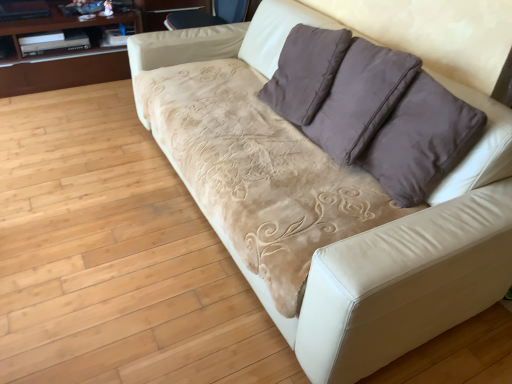
Describe the element at coordinates (421, 141) in the screenshot. The height and width of the screenshot is (384, 512). I see `brown suede pillow at upper right` at that location.

This screenshot has width=512, height=384. What are the coordinates of `velvet beige armchair at upper center` in the screenshot? It's located at (209, 15).

Is brown suede pillow at upper right inside the boundaries of wooden glossy dresser at upper left, or outside?

brown suede pillow at upper right is spatially situated outside wooden glossy dresser at upper left.

Is brown suede pillow at upper right taller or shorter than wooden glossy dresser at upper left?

Considering their sizes, brown suede pillow at upper right has more height than wooden glossy dresser at upper left.

From the image's perspective, which object appears higher, brown suede pillow at upper right or wooden glossy dresser at upper left?

From the image's view, wooden glossy dresser at upper left is above.

Between point (429, 91) and point (69, 54), which one is positioned in front?

Positioned in front is point (429, 91).

This screenshot has height=384, width=512. I want to click on dresser lying behind the brown suede pillow at upper right, so point(62,70).

From the image's perspective, is wooden glossy dresser at upper left under brown suede pillow at upper right?

No, from the image's perspective, wooden glossy dresser at upper left is not beneath brown suede pillow at upper right.

Can you see wooden glossy dresser at upper left touching brown suede pillow at upper right?

No, wooden glossy dresser at upper left is not next to brown suede pillow at upper right.

Looking at this image, between wooden glossy dresser at upper left and brown suede pillow at upper right, which one has smaller size?

Smaller between the two is brown suede pillow at upper right.

Based on the photo, which object is closer to the camera taking this photo, velvet beige armchair at upper center or wooden glossy dresser at upper left?

velvet beige armchair at upper center is more forward.

Is point (214, 15) closer to camera compared to point (30, 24)?

Yes, point (214, 15) is closer to viewer.

Identify the location of dresser below the velvet beige armchair at upper center (from a real-world perspective). This screenshot has width=512, height=384. (62, 70).

Is velvet beige armchair at upper center far from wooden glossy dresser at upper left?

No, there isn't a large distance between velvet beige armchair at upper center and wooden glossy dresser at upper left.

Considering the relative sizes of wooden glossy dresser at upper left and velvet beige armchair at upper center in the image provided, is wooden glossy dresser at upper left smaller than velvet beige armchair at upper center?

Incorrect, wooden glossy dresser at upper left is not smaller in size than velvet beige armchair at upper center.

Identify the location of armchair in front of the wooden glossy dresser at upper left. (209, 15).

Which is correct: wooden glossy dresser at upper left is inside velvet beige armchair at upper center, or outside of it?

wooden glossy dresser at upper left is not inside velvet beige armchair at upper center, it's outside.

Between wooden glossy dresser at upper left and velvet beige armchair at upper center, which one is positioned behind?

wooden glossy dresser at upper left is behind.

Is brown suede pillow at upper right looking in the opposite direction of velvet beige armchair at upper center?

→ That's not correct — brown suede pillow at upper right is not looking away from velvet beige armchair at upper center.

Would you say brown suede pillow at upper right is inside or outside velvet beige armchair at upper center?

brown suede pillow at upper right lies outside velvet beige armchair at upper center.

In the scene shown: Considering the sizes of objects brown suede pillow at upper right and velvet beige armchair at upper center in the image provided, who is taller, brown suede pillow at upper right or velvet beige armchair at upper center?

brown suede pillow at upper right is taller.

From the image's perspective, is velvet beige armchair at upper center below brown suede pillow at upper right?

No, from the image's perspective, velvet beige armchair at upper center is not below brown suede pillow at upper right.

Based on their sizes in the image, would you say velvet beige armchair at upper center is bigger or smaller than brown suede pillow at upper right?

Considering their sizes, velvet beige armchair at upper center takes up less space than brown suede pillow at upper right.

From a real-world perspective, which is physically below, velvet beige armchair at upper center or brown suede pillow at upper right?

velvet beige armchair at upper center, from a real-world perspective.

Considering the relative positions of velvet beige armchair at upper center and brown suede pillow at upper right in the image provided, is velvet beige armchair at upper center to the left of brown suede pillow at upper right from the viewer's perspective?

Yes, velvet beige armchair at upper center is to the left of brown suede pillow at upper right.

I want to click on throw pillow below the wooden glossy dresser at upper left (from the image's perspective), so click(421, 141).

Find the location of `dresser below the brown suede pillow at upper right (from a real-world perspective)`. dresser below the brown suede pillow at upper right (from a real-world perspective) is located at coordinates (62, 70).

From the image, which object appears to be nearer to brown suede pillow at upper right, wooden glossy dresser at upper left or velvet beige armchair at upper center?

The object closer to brown suede pillow at upper right is velvet beige armchair at upper center.

Considering their positions, is wooden glossy dresser at upper left positioned closer to velvet beige armchair at upper center than brown suede pillow at upper right?

wooden glossy dresser at upper left lies closer to velvet beige armchair at upper center than the other object.

When comparing their distances from brown suede pillow at upper right, does velvet beige armchair at upper center or wooden glossy dresser at upper left seem further?

wooden glossy dresser at upper left is further to brown suede pillow at upper right.

Which object lies further to the anchor point wooden glossy dresser at upper left, brown suede pillow at upper right or velvet beige armchair at upper center?

The object further to wooden glossy dresser at upper left is brown suede pillow at upper right.

Which object lies further to the anchor point wooden glossy dresser at upper left, velvet beige armchair at upper center or brown suede pillow at upper right?

Based on the image, brown suede pillow at upper right appears to be further to wooden glossy dresser at upper left.

When comparing their distances from velvet beige armchair at upper center, does brown suede pillow at upper right or wooden glossy dresser at upper left seem closer?

Based on the image, wooden glossy dresser at upper left appears to be nearer to velvet beige armchair at upper center.

Identify the location of armchair situated between wooden glossy dresser at upper left and brown suede pillow at upper right from left to right. Image resolution: width=512 pixels, height=384 pixels. (209, 15).